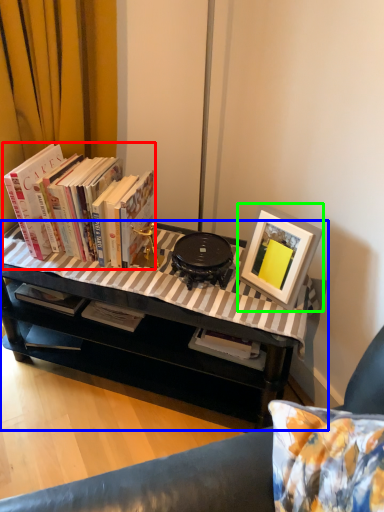
Question: Considering the real-world distances, which object is closest to book (highlighted by a red box)? table (highlighted by a blue box) or picture frame (highlighted by a green box).

Choices:
 (A) table
 (B) picture frame

Answer: (A)